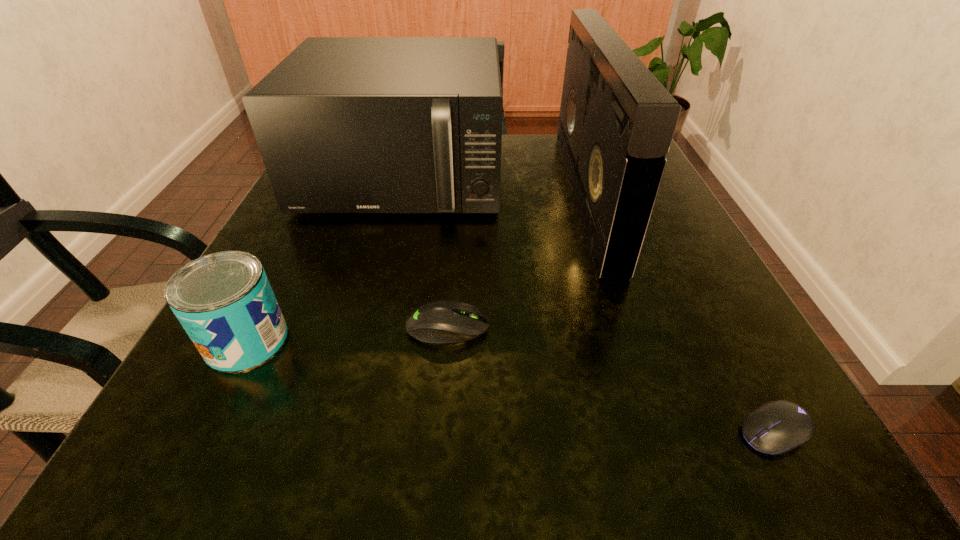
This screenshot has width=960, height=540. I want to click on videotape, so click(x=616, y=124).

Where is `the fourth object from left to right`? The height and width of the screenshot is (540, 960). the fourth object from left to right is located at coordinates (616, 124).

The height and width of the screenshot is (540, 960). What are the coordinates of `microwave oven` in the screenshot? It's located at (344, 124).

The image size is (960, 540). I want to click on can, so click(224, 301).

Locate an element on the screen. The height and width of the screenshot is (540, 960). the farther computer mouse is located at coordinates (438, 322).

Where is `the fourth tallest object`? This screenshot has height=540, width=960. the fourth tallest object is located at coordinates (438, 322).

At what (x,y) coordinates should I click in order to perform the action: click on the nearer computer mouse. Please return your answer as a coordinate pair (x, y). This screenshot has height=540, width=960. Looking at the image, I should click on (777, 427).

I want to click on the shortest object, so click(x=777, y=427).

This screenshot has height=540, width=960. I want to click on vacant space positioned on the front side of the fourth object from left to right, so click(x=547, y=196).

Locate an element on the screen. The image size is (960, 540). vacant region located 0.320m on the front side of the fourth object from left to right is located at coordinates (413, 196).